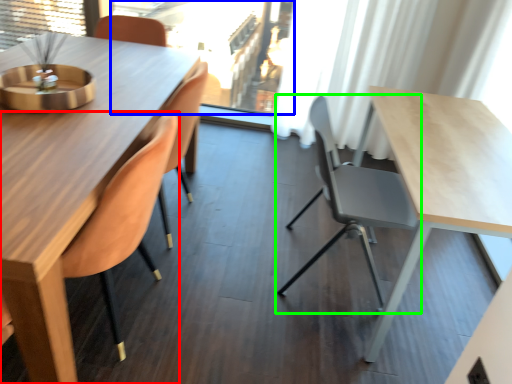
Question: Which is farther away from chair (highlighted by a red box)? window screen (highlighted by a blue box) or chair (highlighted by a green box)?

Choices:
 (A) window screen
 (B) chair

Answer: (A)